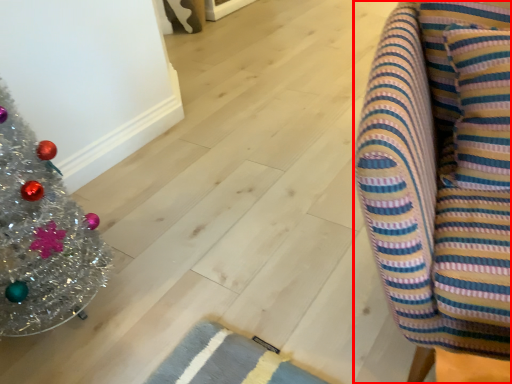
Question: Observing the image, what is the correct spatial positioning of furniture (annotated by the red box) in reference to christmas tree?

Choices:
 (A) left
 (B) right

Answer: (B)